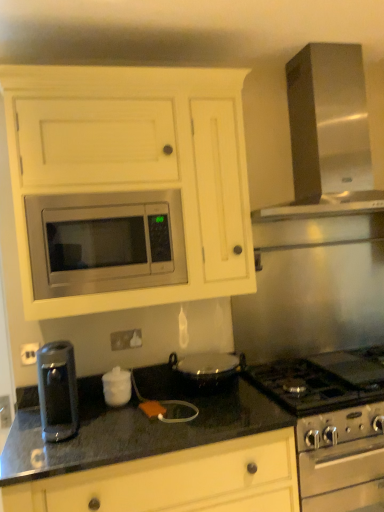
Question: Is white glossy electric outlet at center thinner than satin silver exhaust hood at upper right?

Choices:
 (A) yes
 (B) no

Answer: (A)

Question: Does white glossy electric outlet at center have a larger size compared to satin silver exhaust hood at upper right?

Choices:
 (A) yes
 (B) no

Answer: (B)

Question: Considering the relative sizes of white glossy electric outlet at center and satin silver exhaust hood at upper right in the image provided, is white glossy electric outlet at center taller than satin silver exhaust hood at upper right?

Choices:
 (A) yes
 (B) no

Answer: (B)

Question: From a real-world perspective, is white glossy electric outlet at center over satin silver exhaust hood at upper right?

Choices:
 (A) yes
 (B) no

Answer: (B)

Question: Is white glossy electric outlet at center at the left side of satin silver exhaust hood at upper right?

Choices:
 (A) yes
 (B) no

Answer: (A)

Question: Is white glossy electric outlet at center positioned in front of satin silver exhaust hood at upper right?

Choices:
 (A) no
 (B) yes

Answer: (A)

Question: From the image's perspective, is satin silver exhaust hood at upper right below stainless steel microwave at center?

Choices:
 (A) no
 (B) yes

Answer: (A)

Question: Is stainless steel microwave at center at the back of satin silver exhaust hood at upper right?

Choices:
 (A) no
 (B) yes

Answer: (A)

Question: Are satin silver exhaust hood at upper right and stainless steel microwave at center far apart?

Choices:
 (A) yes
 (B) no

Answer: (A)

Question: Considering the relative sizes of satin silver exhaust hood at upper right and stainless steel microwave at center in the image provided, is satin silver exhaust hood at upper right taller than stainless steel microwave at center?

Choices:
 (A) yes
 (B) no

Answer: (A)

Question: From a real-world perspective, is satin silver exhaust hood at upper right under stainless steel microwave at center?

Choices:
 (A) yes
 (B) no

Answer: (B)

Question: Can you confirm if satin silver exhaust hood at upper right is wider than stainless steel microwave at center?

Choices:
 (A) yes
 (B) no

Answer: (A)

Question: From the image's perspective, is satin silver stove at lower right, which is the first appliance in bottom-to-top order, above stainless steel microwave at center?

Choices:
 (A) no
 (B) yes

Answer: (A)